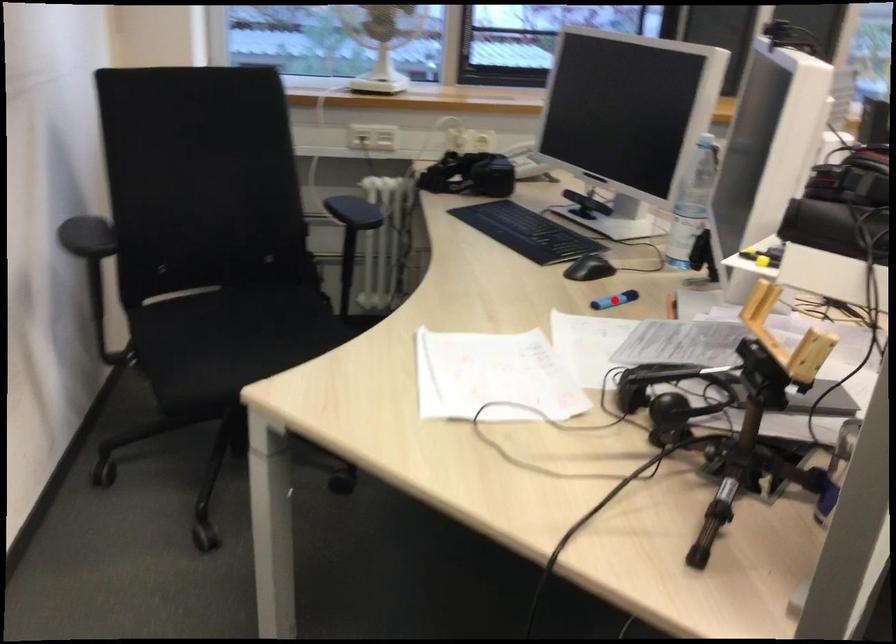
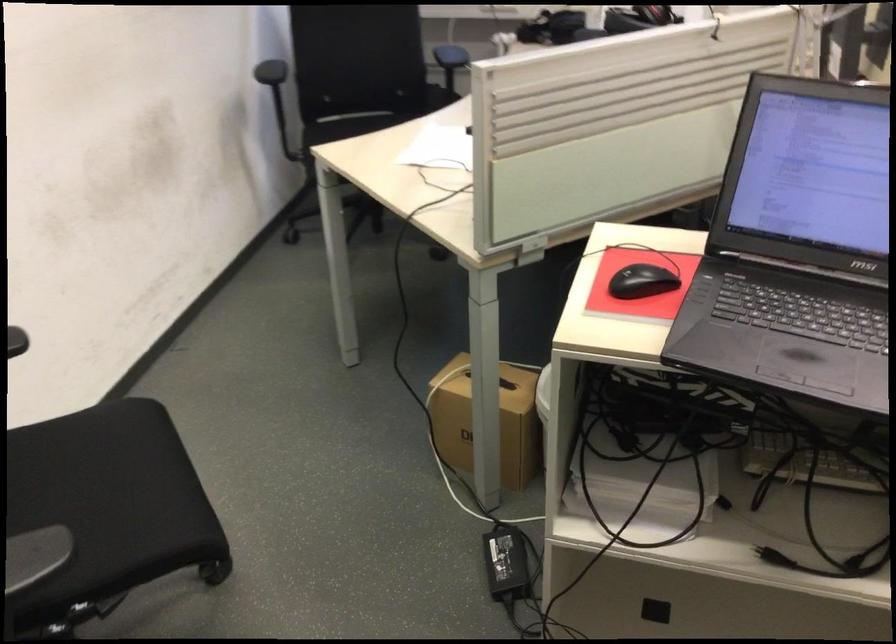
Question: I am providing you with two images of the same scene from different viewpoints. A red point is marked on the first image. Is the red point's position out of view in image 2?

Choices:
 (A) Yes
 (B) No

Answer: (A)